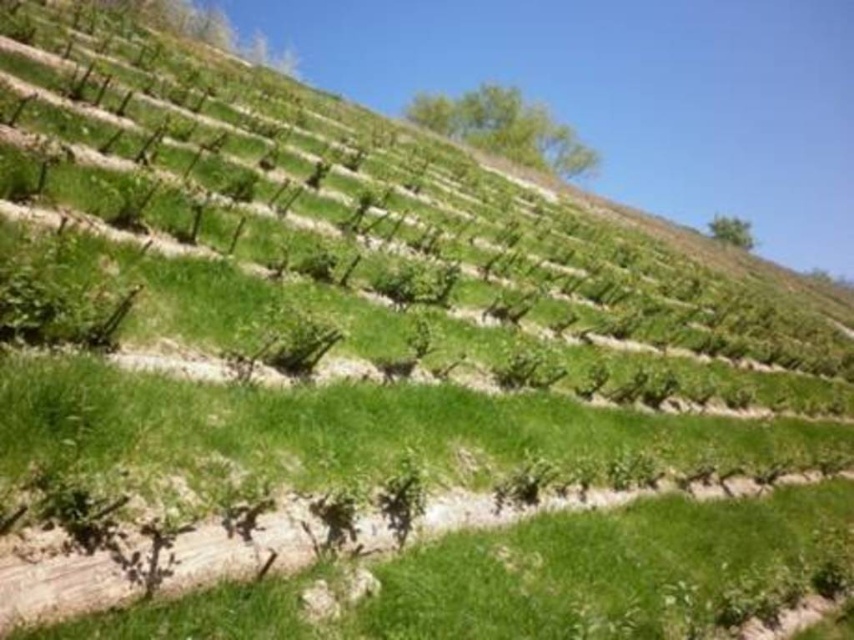
The width and height of the screenshot is (854, 640). Find the location of `green leafy tree at upper center`. green leafy tree at upper center is located at coordinates (506, 129).

Which of these two, green leafy tree at upper center or green leafy tree at upper right, stands shorter?

green leafy tree at upper right is shorter.

Locate an element on the screen. green leafy tree at upper center is located at coordinates (506, 129).